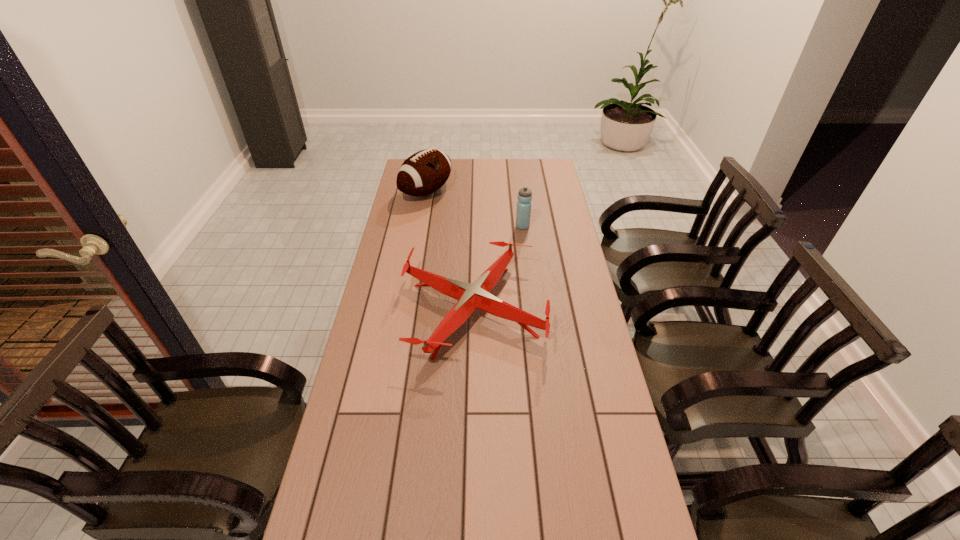
Find the location of a particular element. The width and height of the screenshot is (960, 540). the closest object relative to the second nearest object is located at coordinates (470, 297).

At what (x,y) coordinates should I click in order to perform the action: click on free spot that satisfies the following two spatial constraints: 1. on the back side of the nearest object; 2. on the left side of the water bottle. Please return your answer as a coordinate pair (x, y). The width and height of the screenshot is (960, 540). Looking at the image, I should click on (474, 226).

Locate an element on the screen. The height and width of the screenshot is (540, 960). vacant space that satisfies the following two spatial constraints: 1. on the front side of the water bottle; 2. on the right side of the farthest object is located at coordinates (420, 226).